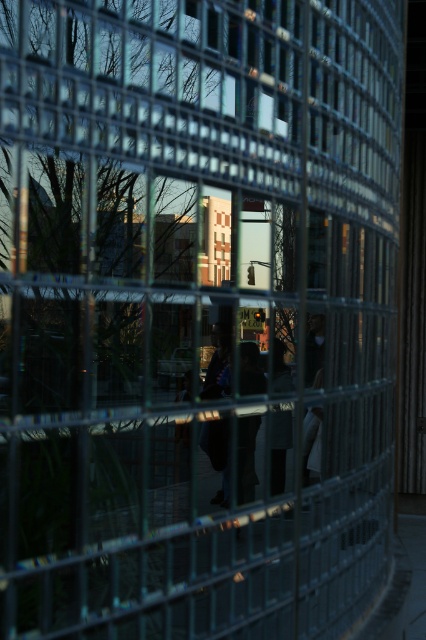
You are standing behind the metal fence and looking at the scene. There is a point marked at coordinates (247, 458). Which object from the list below is this point located on? Choose from the options below. A. A person carrying a bag. B. A person wearing a white top. C. The metal fence itself.

The point (247, 458) is on dark fabric figure at center. The dark fabric figure at center corresponds to a person wearing a white top would be option B.

You are a photographer trying to capture a clear shot of the dark fabric figure at center and the dark gray fabric at center through the grid structure. Given that your camera can only focus on objects within 10 centimeters of each other, will both subjects be in focus?

The distance between the dark fabric figure at center and the dark gray fabric at center is 12.55 centimeters, which exceeds the camera focus range of 10 centimeters. Therefore, both subjects cannot be in focus simultaneously.

You are an observer looking through the metal grid fence. You see a dark fabric figure at center and a dark gray fabric at center. Which object is located to the left of the other?

The dark fabric figure at center is positioned on the left side of dark gray fabric at center.